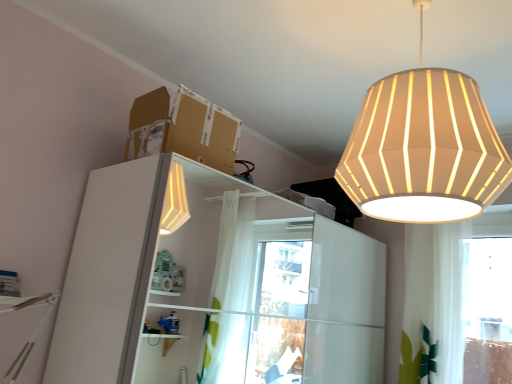
Question: In terms of width, does brown cardboard box at upper center look wider or thinner when compared to white fabric lampshade at upper right?

Choices:
 (A) wide
 (B) thin

Answer: (B)

Question: Do you think brown cardboard box at upper center is within white fabric lampshade at upper right, or outside of it?

Choices:
 (A) outside
 (B) inside

Answer: (A)

Question: Considering the real-world distances, which object is farthest from the white fabric lampshade at upper right?

Choices:
 (A) brown cardboard box at upper center
 (B) white glossy dresser at left

Answer: (B)

Question: Which is nearer to the white fabric lampshade at upper right?

Choices:
 (A) white glossy dresser at left
 (B) brown cardboard box at upper center

Answer: (B)